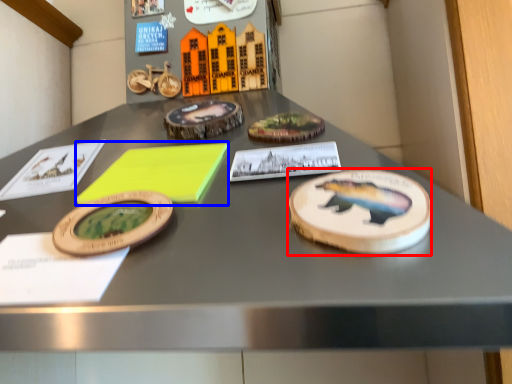
Question: Which object is closer to the camera taking this photo, cake (highlighted by a red box) or notepad (highlighted by a blue box)?

Choices:
 (A) cake
 (B) notepad

Answer: (A)